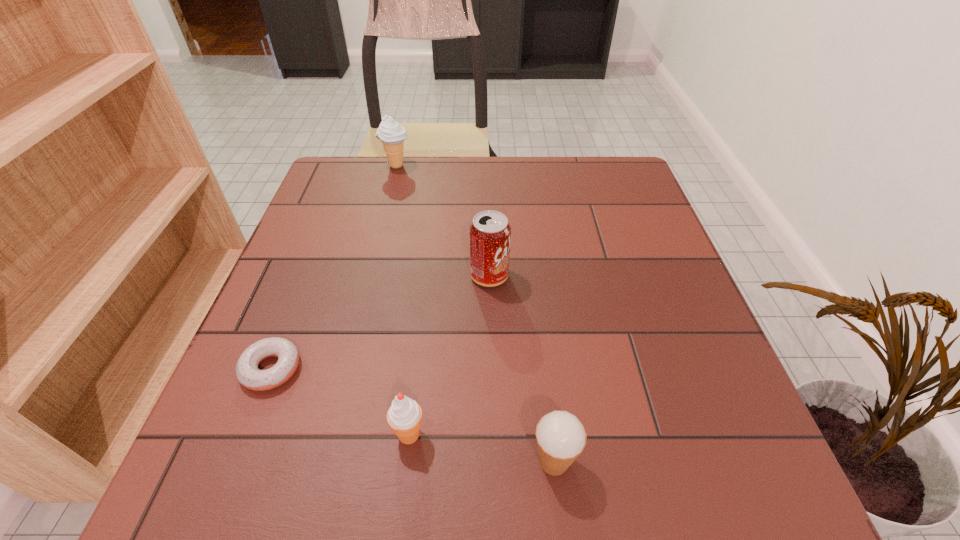
Where is `the leftmost icecream`? the leftmost icecream is located at coordinates (392, 135).

What are the coordinates of `the second object from left to right` in the screenshot? It's located at (392, 135).

At what (x,y) coordinates should I click in order to perform the action: click on soda can. Please return your answer as a coordinate pair (x, y). The image size is (960, 540). Looking at the image, I should click on (490, 233).

Identify the location of the fourth nearest object. (490, 233).

Locate an element on the screen. the second icecream from left to right is located at coordinates (404, 416).

Where is `the rightmost icecream`? Image resolution: width=960 pixels, height=540 pixels. the rightmost icecream is located at coordinates (561, 438).

This screenshot has width=960, height=540. What are the coordinates of `the shortest object` in the screenshot? It's located at (248, 374).

Where is `doughnut`? The image size is (960, 540). doughnut is located at coordinates (248, 374).

At what (x,y) coordinates should I click in order to perform the action: click on blank area located 0.070m on the left of the leftmost icecream. Please return your answer as a coordinate pair (x, y). Image resolution: width=960 pixels, height=540 pixels. Looking at the image, I should click on (357, 166).

Where is `free point located 0.080m on the right of the second object from right to left`? free point located 0.080m on the right of the second object from right to left is located at coordinates (545, 276).